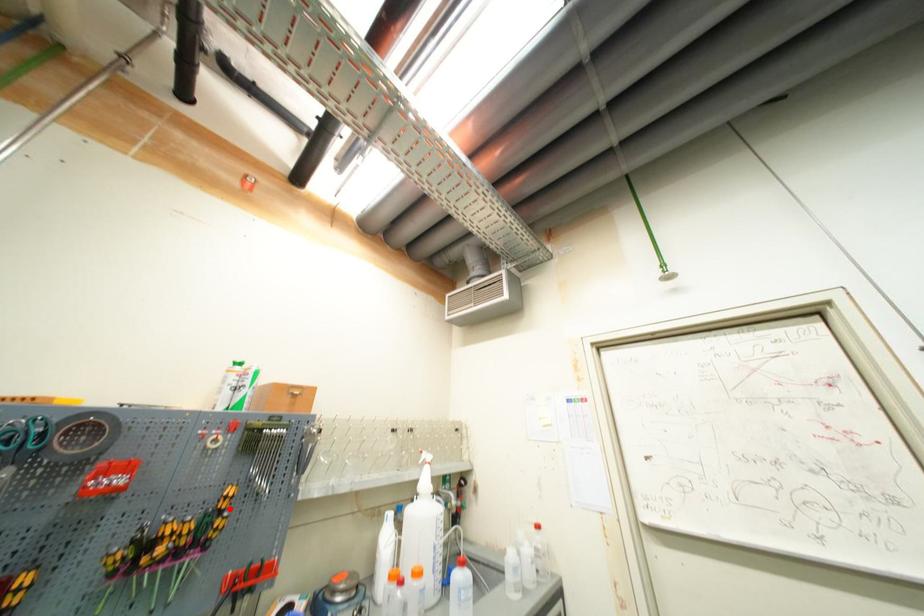
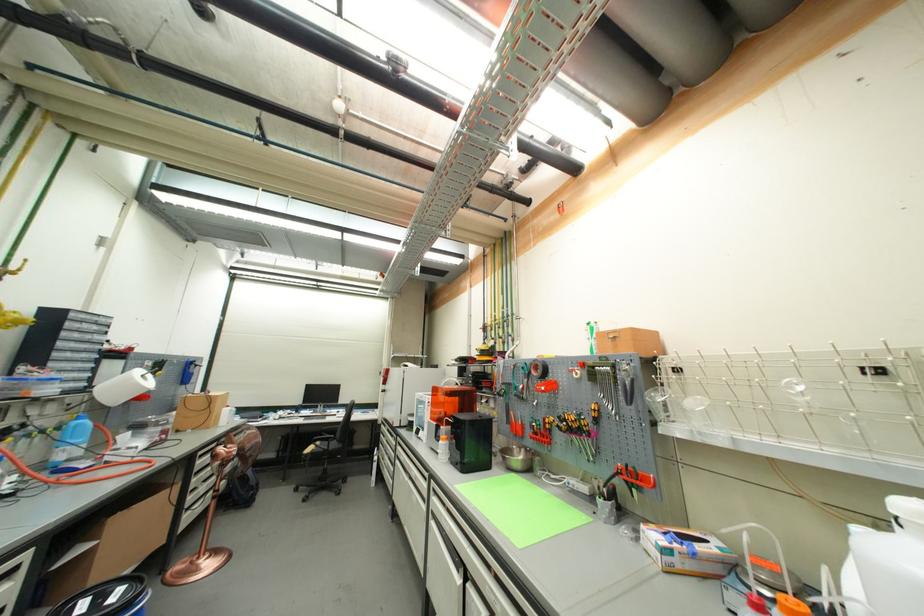
The point at the highlighted location is marked in the first image. Where is the corresponding point in the second image?

(602, 418)